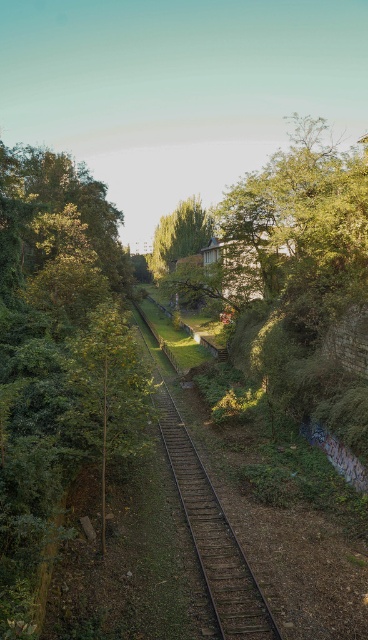
You are a railway inspector checking the safety of the tracks. You notice the brown wooden train track at center and the green leafy tree at center. Which object has a smaller width?

The brown wooden train track at center has a smaller width than the green leafy tree at center.

You are standing at the edge of the railway and notice the brown wooden train track at center and the green leafy tree at center. Which object appears taller in the scene?

The green leafy tree at center is taller than the brown wooden train track at center according to the description.